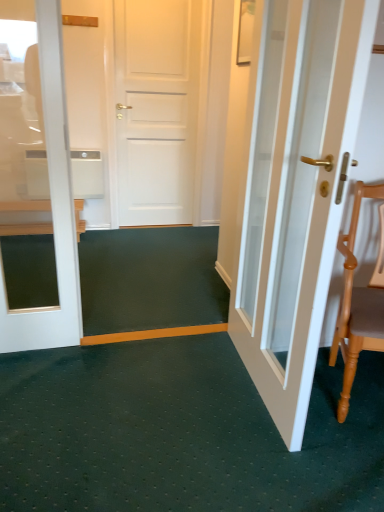
Question: From the image's perspective, would you say light brown wooden chair at right is shown under wooden chair at left?

Choices:
 (A) no
 (B) yes

Answer: (B)

Question: Is light brown wooden chair at right to the left of wooden chair at left from the viewer's perspective?

Choices:
 (A) no
 (B) yes

Answer: (A)

Question: Is light brown wooden chair at right shorter than wooden chair at left?

Choices:
 (A) no
 (B) yes

Answer: (A)

Question: Is light brown wooden chair at right turned away from wooden chair at left?

Choices:
 (A) yes
 (B) no

Answer: (B)

Question: Is light brown wooden chair at right closer to the viewer compared to wooden chair at left?

Choices:
 (A) no
 (B) yes

Answer: (B)

Question: From the image's perspective, is light brown wooden chair at right positioned above or below white glossy door at right?

Choices:
 (A) above
 (B) below

Answer: (B)

Question: Is light brown wooden chair at right situated inside white glossy door at right or outside?

Choices:
 (A) outside
 (B) inside

Answer: (A)

Question: From a real-world perspective, is light brown wooden chair at right positioned above or below white glossy door at right?

Choices:
 (A) below
 (B) above

Answer: (A)

Question: Is point (352, 231) closer or farther from the camera than point (349, 14)?

Choices:
 (A) closer
 (B) farther

Answer: (B)

Question: In terms of height, does white glossy door at right look taller or shorter compared to wooden chair at left?

Choices:
 (A) short
 (B) tall

Answer: (B)

Question: Is white glossy door at right in front of or behind wooden chair at left in the image?

Choices:
 (A) front
 (B) behind

Answer: (A)

Question: Is white glossy door at right situated inside wooden chair at left or outside?

Choices:
 (A) outside
 (B) inside

Answer: (A)

Question: From the image's perspective, is white glossy door at right positioned above or below wooden chair at left?

Choices:
 (A) below
 (B) above

Answer: (A)

Question: Based on their positions, is wooden chair at left located to the left or right of white glossy door at right?

Choices:
 (A) left
 (B) right

Answer: (A)

Question: From the image's perspective, relative to white glossy door at right, is wooden chair at left above or below?

Choices:
 (A) above
 (B) below

Answer: (A)